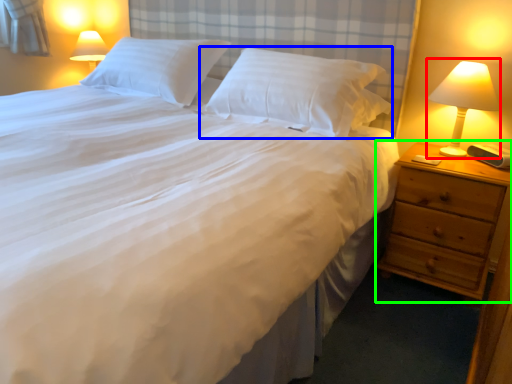
Question: Which object is the farthest from bedside lamp (highlighted by a red box)? Choose among these: pillow (highlighted by a blue box) or nightstand (highlighted by a green box).

Choices:
 (A) pillow
 (B) nightstand

Answer: (A)